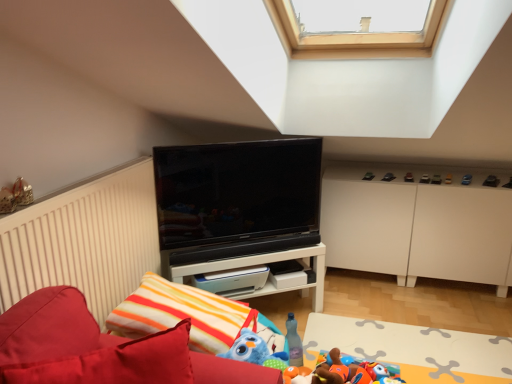
What are the coordinates of `vacant area located to the right-hand side of blue plastic toy at upper right, the second toy viewed from the right` in the screenshot? It's located at (485, 178).